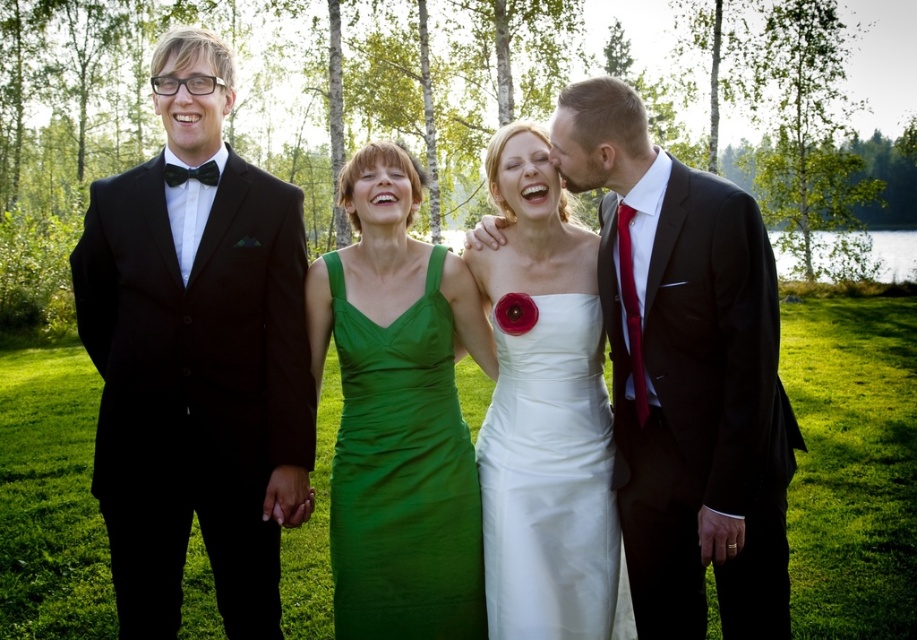
Question: Observing the image, what is the correct spatial positioning of black satin suit at left in reference to white satin dress at center?

Choices:
 (A) right
 (B) left

Answer: (B)

Question: Does black satin suit at left have a lesser width compared to matte green dress at center?

Choices:
 (A) no
 (B) yes

Answer: (A)

Question: Which is nearer to the matte green dress at center?

Choices:
 (A) green satin dress at center
 (B) white satin dress at center
 (C) black satin suit at left
 (D) shiny black suit at center

Answer: (B)

Question: Is black satin suit at left above white satin dress at center?

Choices:
 (A) yes
 (B) no

Answer: (A)

Question: Which point is closer to the camera?

Choices:
 (A) (140, 449)
 (B) (450, 360)
 (C) (604, 278)

Answer: (A)

Question: Which point is closer to the camera?

Choices:
 (A) black satin suit at left
 (B) shiny black suit at center

Answer: (B)